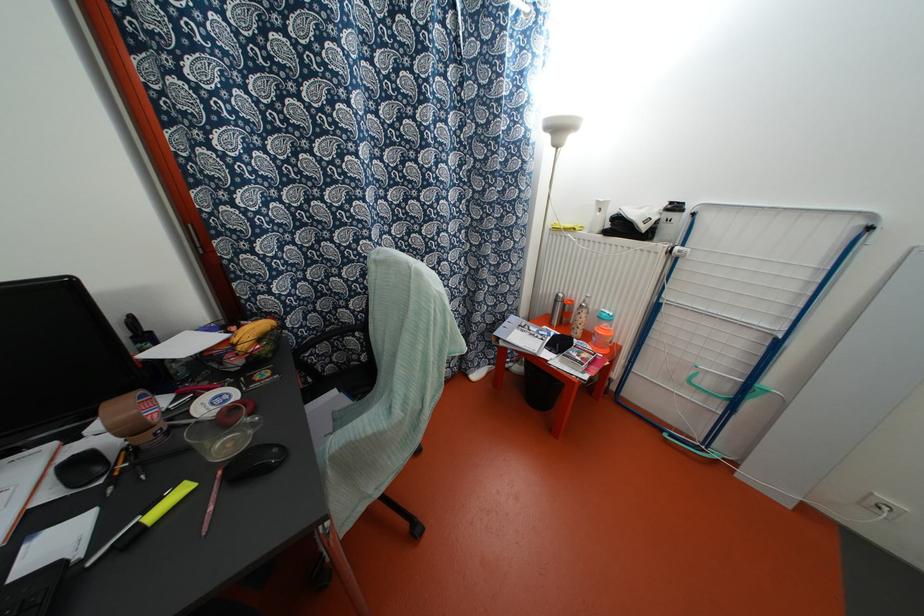
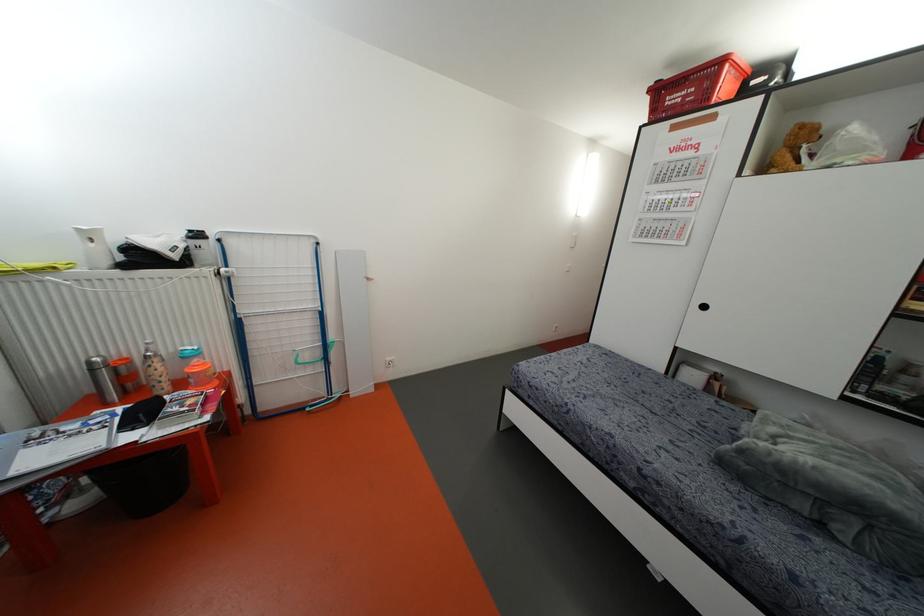
Locate, in the second image, the point that corresponds to point (599, 228) in the first image.

(107, 262)